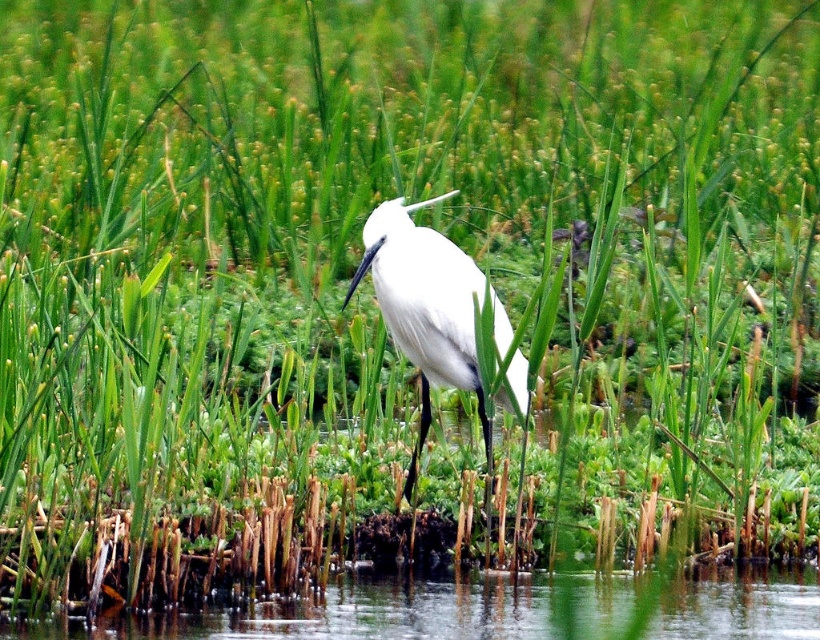
Can you confirm if transparent water at lower center is positioned to the left of white matte bird at center?

In fact, transparent water at lower center is to the right of white matte bird at center.

Is transparent water at lower center wider than white matte bird at center?

Indeed, transparent water at lower center has a greater width compared to white matte bird at center.

Image resolution: width=820 pixels, height=640 pixels. I want to click on transparent water at lower center, so click(x=499, y=611).